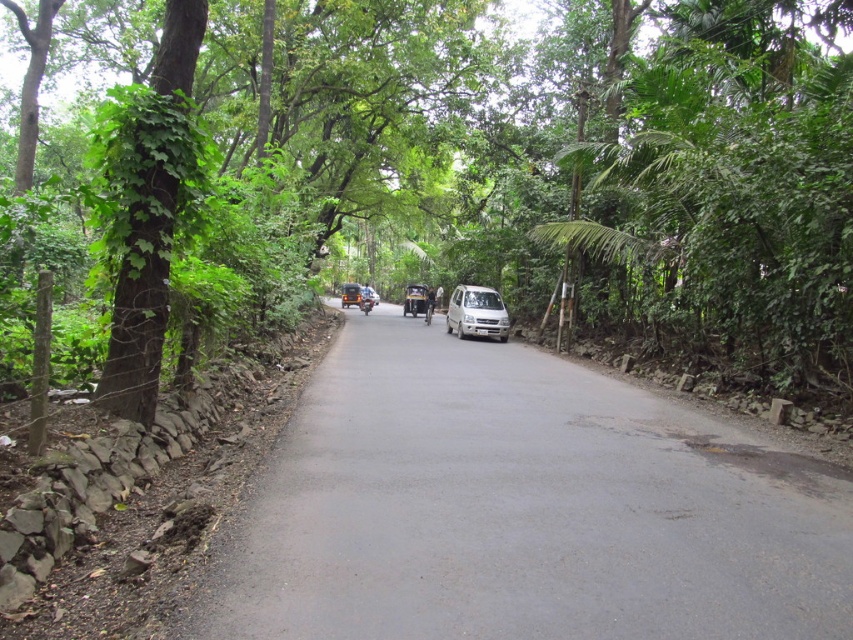
You are a hiker trying to walk along the narrow road between the green leafy tree at center and the green leafy tree at right. The path between them is only 1.2 meters wide. Your backpack is 1 meter wide. Will you be able to pass through without touching either tree?

The green leafy tree at center is wider than the green leafy tree at right. However, the path between them is 1.2 meters wide, which is wider than your backpack of 1 meter. Therefore, you can pass through without touching either tree.

You are driving a car and see the white matte van at center ahead on the narrow road. If you want to overtake the van, where should you position your car relative to the van?

To overtake the white matte van at center, position your car to the right side of the van since the road curves slightly to the right, allowing better visibility and space for maneuvering.